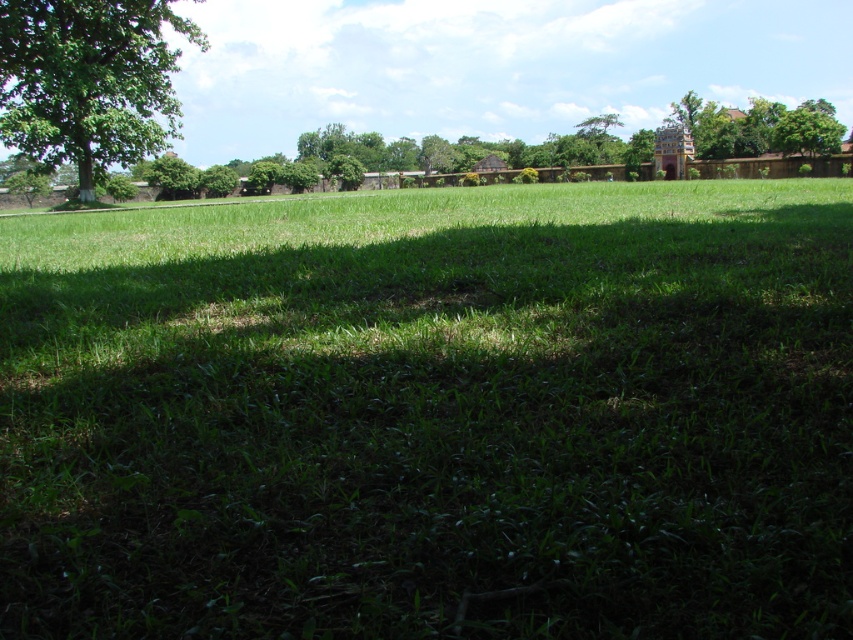
You are standing in the middle of the green grassy field at center and want to walk towards the green leafy tree at upper left. Which direction should you head?

The green grassy field at center is to the right of the green leafy tree at upper left, so you should head left to reach the tree.

You are standing at the origin point in the image. Where is the green grassy field at center located in terms of coordinates?

The green grassy field at center is located at coordinates point (432,413).

You are planning to set up a picnic blanket in the green grassy field at center. Considering the size of the green leafy tree at upper left, do you think the field is wide enough to accommodate a picnic blanket that is 2 meters wide?

The green grassy field at center is wider than the green leafy tree at upper left. Since the field is wider, it should have enough space to accommodate a picnic blanket that is 2 meters wide.